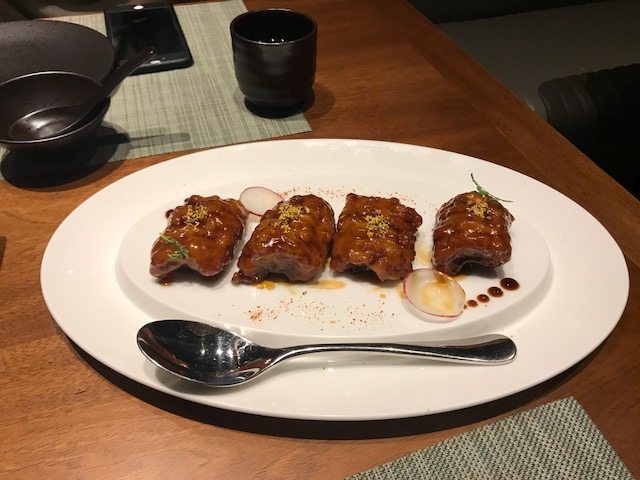
The image size is (640, 480). Find the location of `phone`. phone is located at coordinates (148, 35).